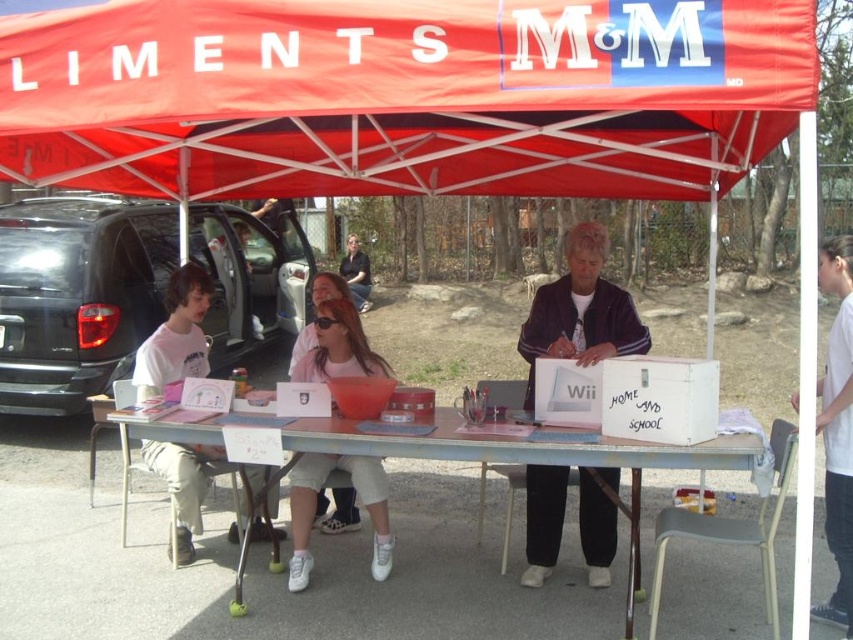
Between pink fabric shirt at center and matte pink shirt at center, which one appears on the left side from the viewer's perspective?

matte pink shirt at center

Who is lower down, pink fabric shirt at center or matte pink shirt at center?

pink fabric shirt at center

Where is `pink fabric shirt at center`? pink fabric shirt at center is located at coordinates (315, 502).

Does red fabric canopy at upper center appear on the left side of black matte van at left?

In fact, red fabric canopy at upper center is to the right of black matte van at left.

Between red fabric canopy at upper center and black matte van at left, which one has more height?

Standing taller between the two is black matte van at left.

Which is in front, point (224, 20) or point (82, 371)?

Point (224, 20) is more forward.

Image resolution: width=853 pixels, height=640 pixels. In order to click on red fabric canopy at upper center in this screenshot , I will do `click(403, 96)`.

Measure the distance from black matte van at left to pink plastic table at center.

The distance of black matte van at left from pink plastic table at center is 10.07 feet.

Which is in front, point (57, 404) or point (329, 420)?

Positioned in front is point (329, 420).

The image size is (853, 640). What are the coordinates of `black matte van at left` in the screenshot? It's located at 77,296.